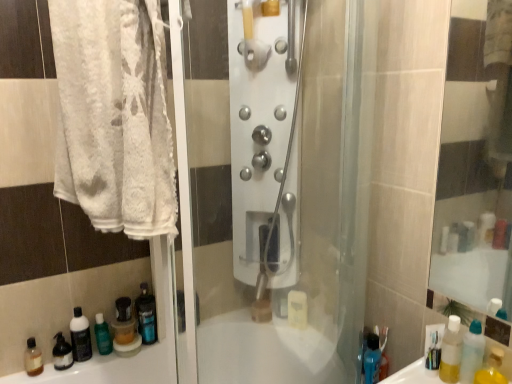
Question: Considering the relative sizes of green matte bottle at lower left and blue translucent bottle at lower right, the 2th bottle when ordered from front to back, in the image provided, is green matte bottle at lower left bigger than blue translucent bottle at lower right, the 2th bottle when ordered from front to back,?

Choices:
 (A) yes
 (B) no

Answer: (A)

Question: Does green matte bottle at lower left have a smaller size compared to blue translucent bottle at lower right, which is counted as the second bottle, starting from the right?

Choices:
 (A) no
 (B) yes

Answer: (A)

Question: Does green matte bottle at lower left have a lesser height compared to blue translucent bottle at lower right, the 2th bottle when ordered from front to back?

Choices:
 (A) no
 (B) yes

Answer: (B)

Question: Is green matte bottle at lower left taller than blue translucent bottle at lower right, positioned as the 2th bottle in left-to-right order?

Choices:
 (A) no
 (B) yes

Answer: (A)

Question: Is green matte bottle at lower left thinner than blue translucent bottle at lower right, arranged as the 2th bottle when viewed from the back?

Choices:
 (A) no
 (B) yes

Answer: (A)

Question: From the image's perspective, is brown matte bottle at lower left, the first mouthwash from the left, positioned above or below satin nickel shower controls at center?

Choices:
 (A) above
 (B) below

Answer: (B)

Question: Considering the positions of brown matte bottle at lower left, placed as the fifth mouthwash when sorted from right to left, and satin nickel shower controls at center in the image, is brown matte bottle at lower left, placed as the fifth mouthwash when sorted from right to left, taller or shorter than satin nickel shower controls at center?

Choices:
 (A) tall
 (B) short

Answer: (B)

Question: Is brown matte bottle at lower left, the first mouthwash from the left, in front of or behind satin nickel shower controls at center in the image?

Choices:
 (A) front
 (B) behind

Answer: (B)

Question: Based on their sizes in the image, would you say brown matte bottle at lower left, which is the third mouthwash in back-to-front order, is bigger or smaller than satin nickel shower controls at center?

Choices:
 (A) big
 (B) small

Answer: (B)

Question: Is transparent plastic bottle at lower right, the 3th bottle when ordered from back to front, wider or thinner than satin nickel shower controls at center?

Choices:
 (A) thin
 (B) wide

Answer: (A)

Question: From a real-world perspective, is transparent plastic bottle at lower right, the 3th bottle when ordered from back to front, above or below satin nickel shower controls at center?

Choices:
 (A) below
 (B) above

Answer: (A)

Question: Is transparent plastic bottle at lower right, acting as the 1th bottle starting from the front, inside the boundaries of satin nickel shower controls at center, or outside?

Choices:
 (A) outside
 (B) inside

Answer: (A)

Question: Is point (474, 332) positioned closer to the camera than point (291, 215)?

Choices:
 (A) farther
 (B) closer

Answer: (A)

Question: From the image's perspective, is brown matte bottle at lower left, the first mouthwash from the left, positioned above or below green matte bottle at lower left?

Choices:
 (A) below
 (B) above

Answer: (A)

Question: Is brown matte bottle at lower left, the first mouthwash from the left, in front of or behind green matte bottle at lower left in the image?

Choices:
 (A) front
 (B) behind

Answer: (A)